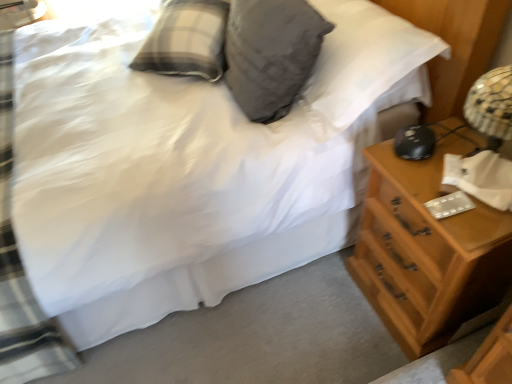
Question: Is gray soft pillow at upper center inside or outside of wooden chest of drawers at right?

Choices:
 (A) inside
 (B) outside

Answer: (B)

Question: In terms of size, does gray soft pillow at upper center appear bigger or smaller than wooden chest of drawers at right?

Choices:
 (A) small
 (B) big

Answer: (A)

Question: Would you say gray soft pillow at upper center is to the left or to the right of wooden chest of drawers at right in the picture?

Choices:
 (A) left
 (B) right

Answer: (A)

Question: Based on their sizes in the image, would you say wooden chest of drawers at right is bigger or smaller than gray soft pillow at upper center?

Choices:
 (A) big
 (B) small

Answer: (A)

Question: Would you say wooden chest of drawers at right is inside or outside gray soft pillow at upper center?

Choices:
 (A) outside
 (B) inside

Answer: (A)

Question: From the image's perspective, is wooden chest of drawers at right above or below gray soft pillow at upper center?

Choices:
 (A) above
 (B) below

Answer: (B)

Question: From a real-world perspective, is wooden chest of drawers at right positioned above or below gray soft pillow at upper center?

Choices:
 (A) above
 (B) below

Answer: (B)